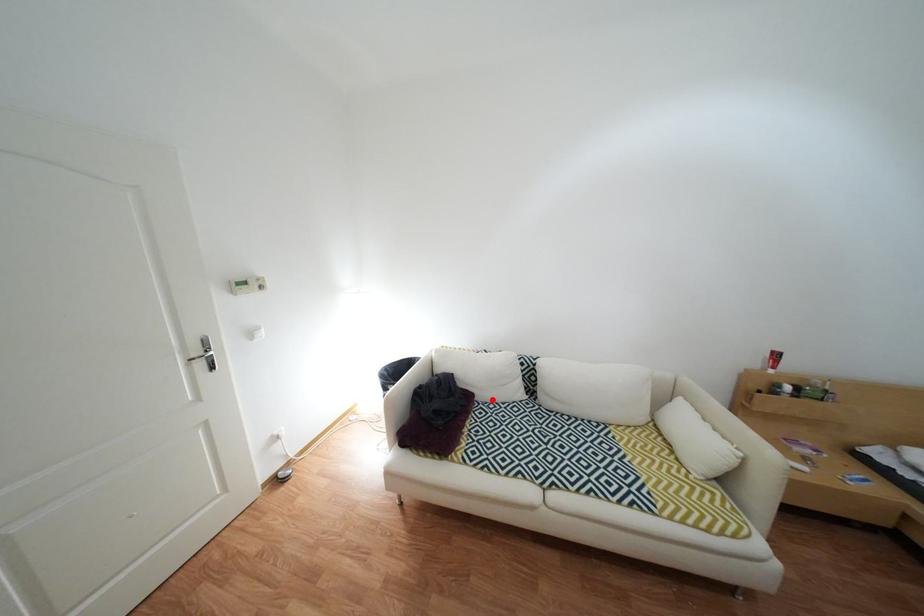
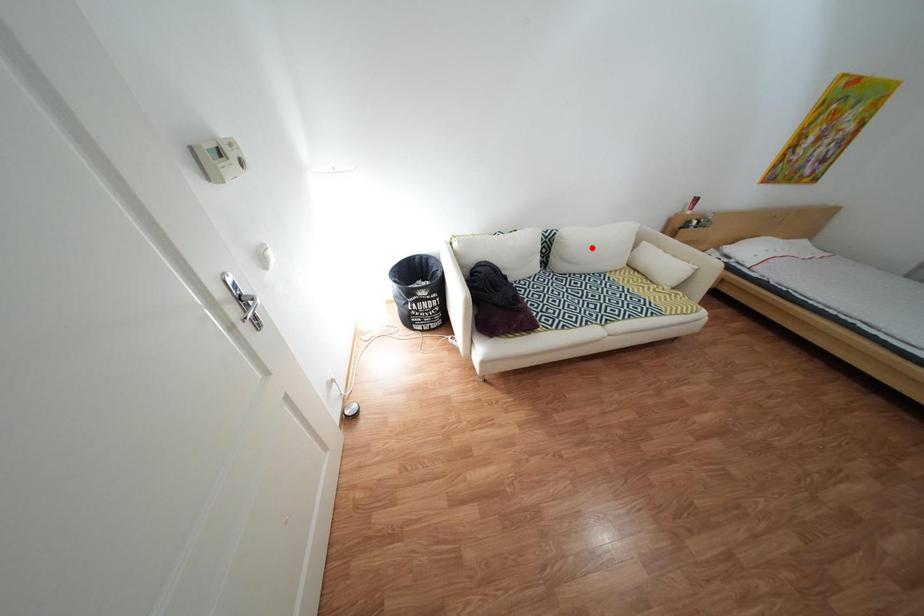
I am providing you with two images of the same scene from different viewpoints. A red point is marked on the first image and another point is marked on the second image. Do the highlighted points in image1 and image2 indicate the same real-world spot?

No